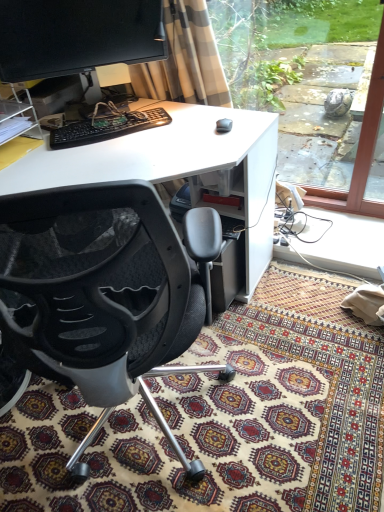
Question: Does point (221, 472) appear closer or farther from the camera than point (76, 138)?

Choices:
 (A) closer
 (B) farther

Answer: (A)

Question: Would you say patterned carpet at lower center is to the left or to the right of black plastic keyboard at center in the picture?

Choices:
 (A) left
 (B) right

Answer: (B)

Question: Estimate the real-world distances between objects in this image. Which object is farther from the white plastic desk at center?

Choices:
 (A) satin beige curtain at upper center
 (B) matte black monitor at upper left
 (C) patterned carpet at lower center
 (D) black plastic keyboard at center
 (E) transparent glass window at right

Answer: (E)

Question: Which object is positioned farthest from the black plastic keyboard at center?

Choices:
 (A) black mesh chair at center
 (B) patterned carpet at lower center
 (C) satin beige curtain at upper center
 (D) matte black monitor at upper left
 (E) white plastic desk at center

Answer: (B)